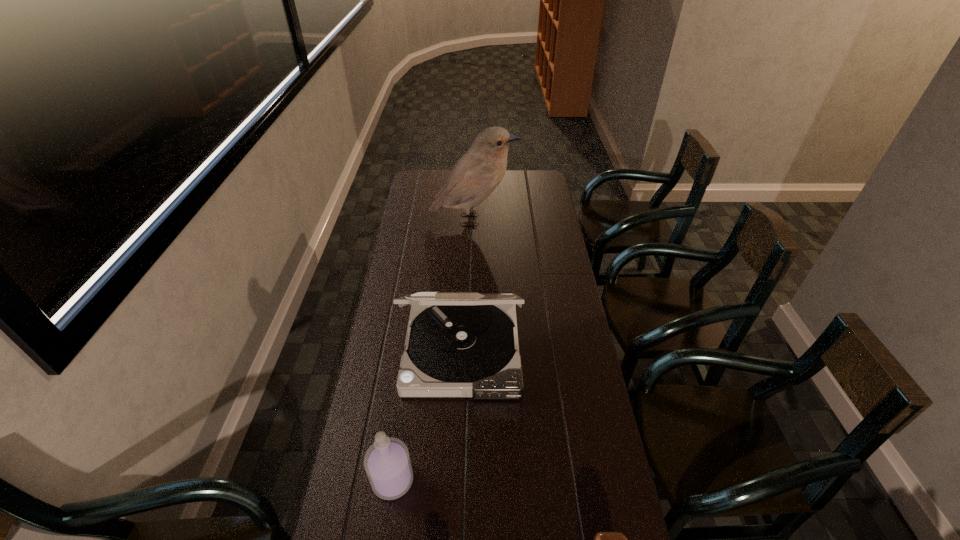
You are a GUI agent. You are given a task and a screenshot of the screen. Output one action in this format:
    pyautogui.click(x=<x>, y=<y>)
    Task: Click on the CD player that is at the left edge
    
    Given the screenshot: What is the action you would take?
    pyautogui.click(x=458, y=344)

Locate an element on the screen. perfume located at the left edge is located at coordinates (387, 463).

This screenshot has height=540, width=960. I want to click on free space at the left edge of the desktop, so click(384, 532).

Find the location of a particular element. Image resolution: width=960 pixels, height=540 pixels. free space at the right edge of the desktop is located at coordinates (593, 371).

I want to click on vacant space at the far right corner of the desktop, so click(x=540, y=187).

Where is `free space between the parakeet and the second farthest object`? free space between the parakeet and the second farthest object is located at coordinates (468, 284).

Where is `object that ranks as the second closest to the CD player`? Image resolution: width=960 pixels, height=540 pixels. object that ranks as the second closest to the CD player is located at coordinates (602, 539).

This screenshot has height=540, width=960. In order to click on object that is the closest to the third farthest object in this screenshot , I will do `click(458, 344)`.

Identify the location of vacant space that satisfies the following two spatial constraints: 1. on the face of the parakeet; 2. on the control panel of the CD player. (470, 348).